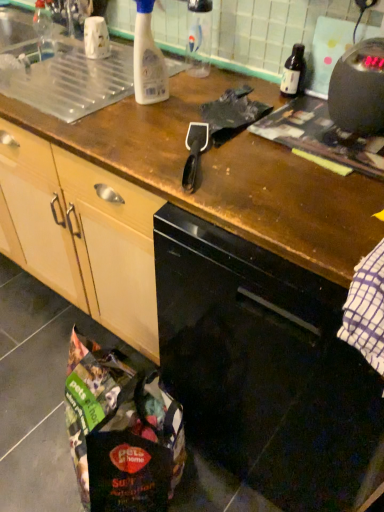
Identify the location of blank space to the left of translucent glass bottle at upper right, acting as the 1th bottle starting from the right. (227, 88).